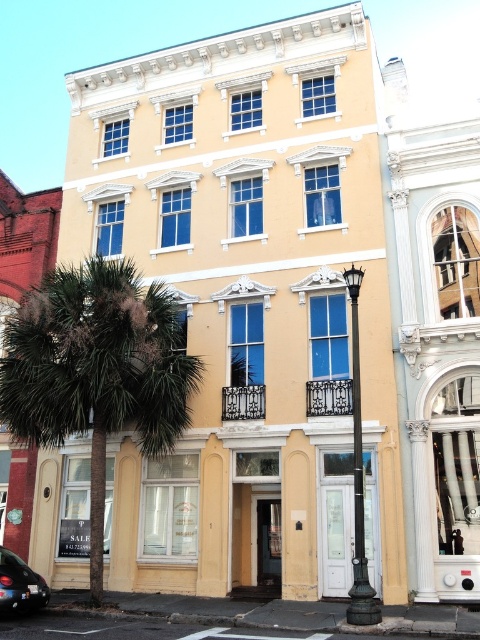
Question: Which point is closer to the camera?

Choices:
 (A) shiny black car at lower left
 (B) green leafy palm tree at left

Answer: (A)

Question: Can you confirm if green leafy palm tree at left is thinner than shiny black car at lower left?

Choices:
 (A) no
 (B) yes

Answer: (A)

Question: Is green leafy palm tree at left below shiny black car at lower left?

Choices:
 (A) no
 (B) yes

Answer: (A)

Question: Among these points, which one is nearest to the camera?

Choices:
 (A) (130, 349)
 (B) (17, 608)

Answer: (B)

Question: Does green leafy palm tree at left come behind shiny black car at lower left?

Choices:
 (A) no
 (B) yes

Answer: (B)